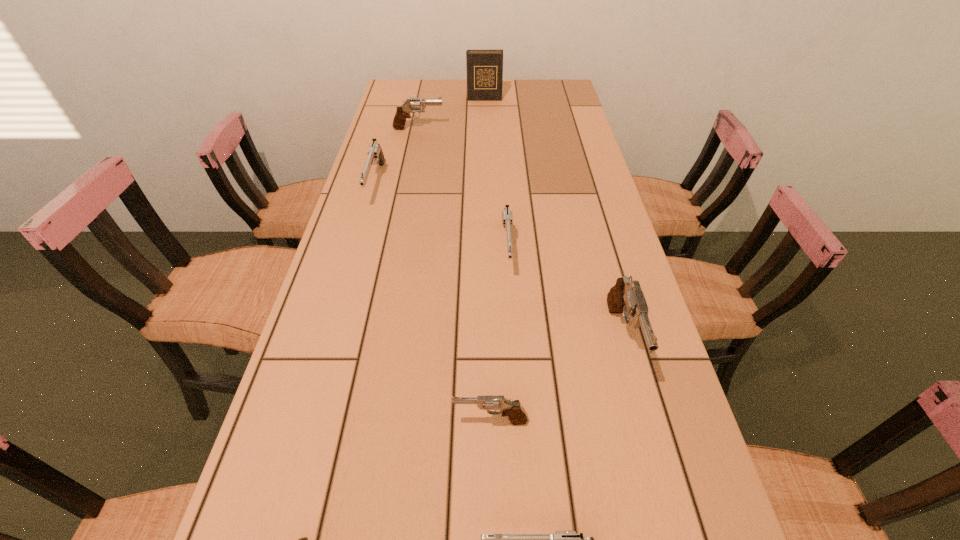
At what (x,y) coordinates should I click in order to perform the action: click on empty space that is in between the tallest pistol and the second gray pistol from right to left. Please return your answer as a coordinate pair (x, y). The width and height of the screenshot is (960, 540). Looking at the image, I should click on (557, 380).

Image resolution: width=960 pixels, height=540 pixels. I want to click on vacant region between the seventh shortest object and the leftmost silver pistol, so click(499, 261).

I want to click on free space between the leftmost silver pistol and the third nearest pistol, so click(433, 302).

The height and width of the screenshot is (540, 960). Identify the location of free point between the leftmost gray pistol and the fifth nearest pistol. (463, 188).

Identify which object is the third nearest to the sixth tallest pistol. Please provide its 2D coordinates. Your answer should be formatted as a tuple, i.e. [(x, y)], where the tuple contains the x and y coordinates of a point satisfying the conditions above.

[(626, 297)]

Identify which object is the second nearest to the second farthest pistol. Please provide its 2D coordinates. Your answer should be formatted as a tuple, i.e. [(x, y)], where the tuple contains the x and y coordinates of a point satisfying the conditions above.

[(507, 218)]

At what (x,y) coordinates should I click in order to perform the action: click on pistol that stands as the fifth closest to the fourth nearest object. Please return your answer as a coordinate pair (x, y). Looking at the image, I should click on pyautogui.click(x=375, y=155).

Identify the location of pistol object that ranks as the closest to the rightmost object. This screenshot has height=540, width=960. (517, 415).

Select which gray pistol is the closest to the second farthest object. Please provide its 2D coordinates. Your answer should be formatted as a tuple, i.e. [(x, y)], where the tuple contains the x and y coordinates of a point satisfying the conditions above.

[(626, 297)]

Locate which gray pistol ranks third in proximity to the third farthest object. Please provide its 2D coordinates. Your answer should be formatted as a tuple, i.e. [(x, y)], where the tuple contains the x and y coordinates of a point satisfying the conditions above.

[(626, 297)]